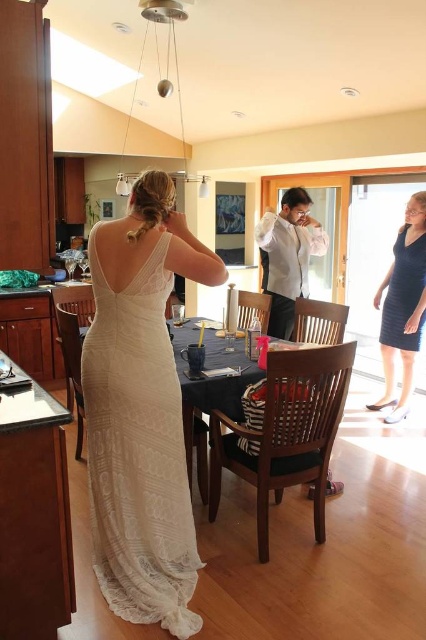
Question: Observing the image, what is the correct spatial positioning of white lace dress at center in reference to dark blue textured dress at lower right?

Choices:
 (A) above
 (B) below

Answer: (B)

Question: Which point is farther from the camera taking this photo?

Choices:
 (A) (150, 353)
 (B) (409, 211)
 (C) (408, 308)

Answer: (C)

Question: Among these points, which one is nearest to the camera?

Choices:
 (A) (397, 269)
 (B) (406, 260)
 (C) (183, 444)

Answer: (C)

Question: Which point appears farthest from the camera in this image?

Choices:
 (A) (103, 502)
 (B) (377, 406)

Answer: (B)

Question: Is dark blue textured dress at lower right wider than black matte dress at right?

Choices:
 (A) no
 (B) yes

Answer: (B)

Question: Can you confirm if dark blue textured dress at lower right is smaller than black matte dress at right?

Choices:
 (A) yes
 (B) no

Answer: (B)